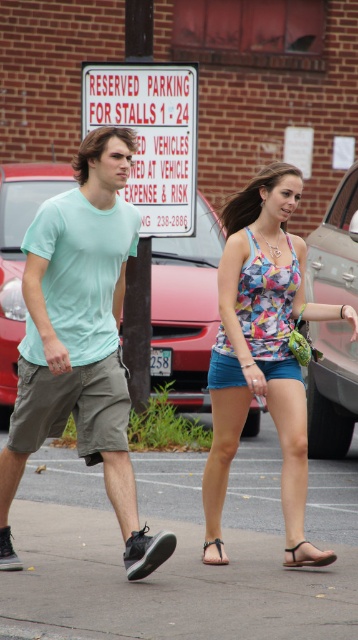
You are a delivery robot with a 3.5 feet wide package. You need to move from the floral tank top at center to the blue fabric sandal at lower center. Can your package fit through the space between them?

The distance between the floral tank top at center and the blue fabric sandal at lower center is 4.78 feet. Since the package is 3.5 feet wide, it can fit through the space as the distance is greater than the package width.

You are standing at the signpost in the background of the image. You see two points marked on the ground ahead of you. The first point is labeled as point (40, 317) and the second is labeled as point (258, 332). Which point is closer to you?

Point (40, 317) is closer to the viewer than point (258, 332).

Two people are walking in a parking lot. They are both wearing tank tops. The floral tank top at center and the printed fabric tank top at center are 37.83 inches apart. The person wearing the floral tank top is holding a small green purse. Can the person in the printed fabric tank top reach the purse without moving closer?

The floral tank top at center and the printed fabric tank top at center are 37.83 inches apart. Since the distance between them is over 3 feet, the person in the printed fabric tank top cannot reach the purse without moving closer.